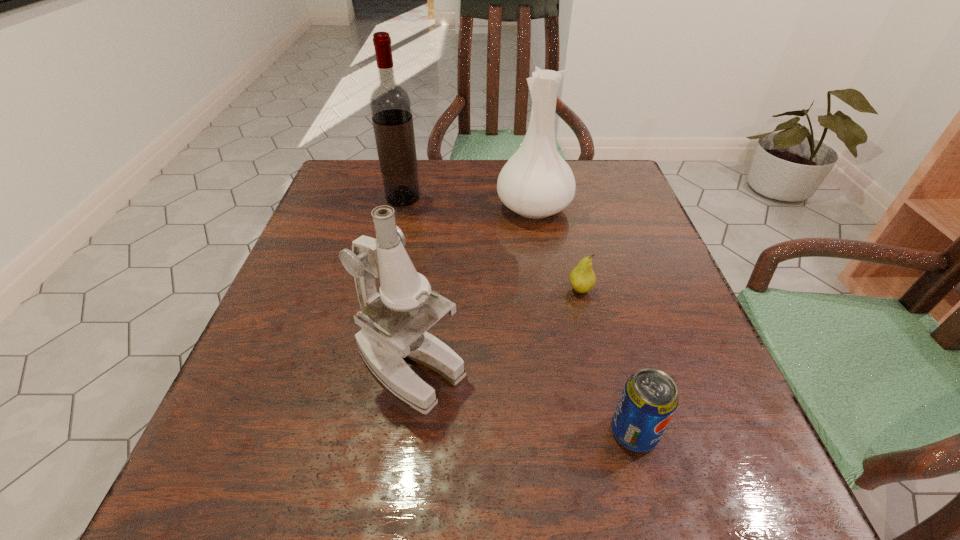
Where is `vacant area at the left edge`? The height and width of the screenshot is (540, 960). vacant area at the left edge is located at coordinates (333, 362).

I want to click on vacant area at the right edge, so click(614, 300).

Locate an element on the screen. vacant region at the far left corner of the desktop is located at coordinates (369, 159).

In the image, there is a desktop. At what (x,y) coordinates should I click in order to perform the action: click on vacant space at the near left corner. Please return your answer as a coordinate pair (x, y). Looking at the image, I should click on (227, 510).

In the image, there is a desktop. Identify the location of vacant space at the far right corner. (602, 198).

Locate an element on the screen. The image size is (960, 540). vacant area that lies between the microscope and the pear is located at coordinates (495, 328).

The height and width of the screenshot is (540, 960). In order to click on free point between the wine bottle and the shortest object in this screenshot , I will do `click(492, 244)`.

Where is `vacant area that lies between the microscope and the third farthest object`? vacant area that lies between the microscope and the third farthest object is located at coordinates (495, 328).

At what (x,y) coordinates should I click in order to perform the action: click on blank region between the third nearest object and the wine bottle. Please return your answer as a coordinate pair (x, y). Image resolution: width=960 pixels, height=540 pixels. Looking at the image, I should click on (492, 244).

Where is `vacant area that lies between the shortest object and the microscope`? vacant area that lies between the shortest object and the microscope is located at coordinates (495, 328).